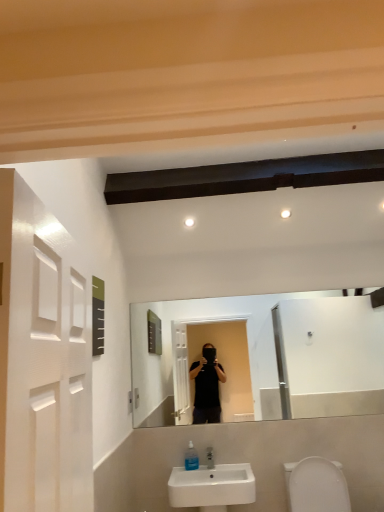
Question: Considering the positions of transparent plastic soap dispenser at lower center and white glossy toilet bowl at lower right in the image, is transparent plastic soap dispenser at lower center taller or shorter than white glossy toilet bowl at lower right?

Choices:
 (A) short
 (B) tall

Answer: (A)

Question: Would you say transparent plastic soap dispenser at lower center is inside or outside white glossy toilet bowl at lower right?

Choices:
 (A) outside
 (B) inside

Answer: (A)

Question: Which of these objects is positioned closest to the white ceramic sink at lower center?

Choices:
 (A) white glossy toilet bowl at lower right
 (B) transparent plastic soap dispenser at lower center

Answer: (B)

Question: Which object is the farthest from the white glossy toilet bowl at lower right?

Choices:
 (A) white ceramic sink at lower center
 (B) transparent plastic soap dispenser at lower center

Answer: (B)